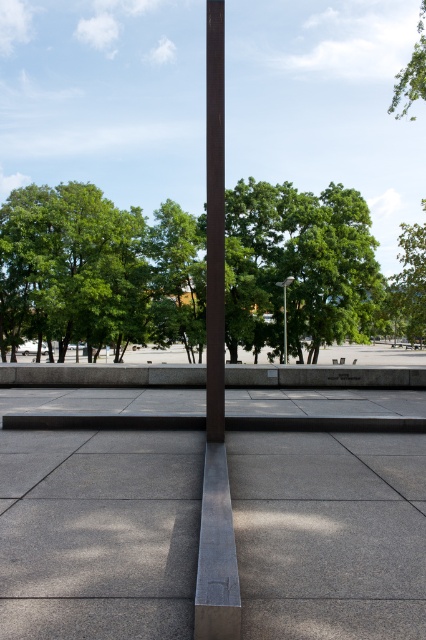
Question: Which object appears farthest from the camera in this image?

Choices:
 (A) gray concrete pavement at center
 (B) white plastic street sign at upper center
 (C) green leafy tree at upper right

Answer: (B)

Question: Does gray concrete pavement at center have a greater width compared to green leafy tree at upper right?

Choices:
 (A) yes
 (B) no

Answer: (B)

Question: Which point appears closest to the camera in this image?

Choices:
 (A) (198, 433)
 (B) (423, 28)

Answer: (A)

Question: From the image, what is the correct spatial relationship of satin brown pole at center in relation to green leafy tree at upper right?

Choices:
 (A) right
 (B) left

Answer: (B)

Question: Which of the following is the closest to the observer?

Choices:
 (A) satin brown pole at center
 (B) gray concrete pavement at center
 (C) green leafy tree at upper right

Answer: (A)

Question: In this image, where is satin brown pole at center located relative to white plastic street sign at upper center?

Choices:
 (A) right
 (B) left

Answer: (B)